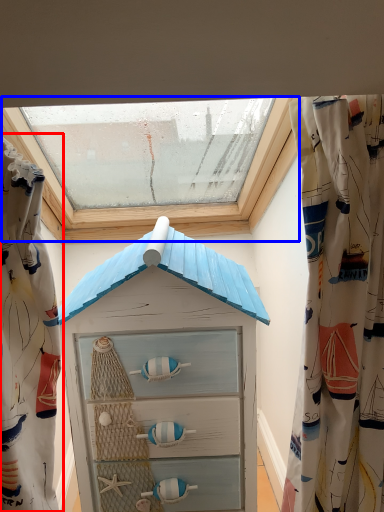
Question: Which of the following is the farthest to the observer, curtain (highlighted by a red box) or window (highlighted by a blue box)?

Choices:
 (A) curtain
 (B) window

Answer: (B)